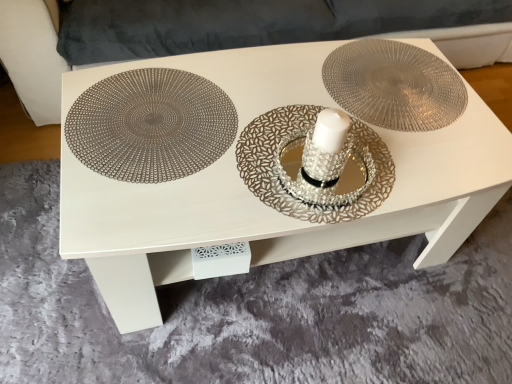
Question: From a real-world perspective, relative to silver textured plate at center, is suede-like gray couch at upper center vertically above or below?

Choices:
 (A) below
 (B) above

Answer: (A)

Question: From the image's perspective, relative to silver textured plate at center, is suede-like gray couch at upper center above or below?

Choices:
 (A) above
 (B) below

Answer: (A)

Question: Which object is the farthest from the metallic woven placemat at left?

Choices:
 (A) metallic textured saucer at center
 (B) suede-like gray couch at upper center
 (C) metallic placemat at center
 (D) silver textured plate at center

Answer: (B)

Question: Based on their relative distances, which object is nearer to the metallic textured saucer at center?

Choices:
 (A) metallic placemat at center
 (B) silver textured plate at center
 (C) suede-like gray couch at upper center
 (D) metallic woven placemat at left

Answer: (A)